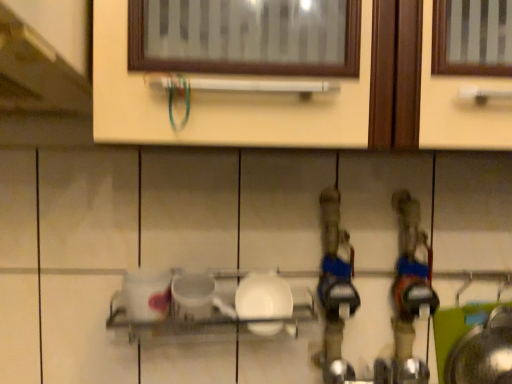
Question: Is white glossy plate at center inside the boundaries of white glossy plate at center, or outside?

Choices:
 (A) inside
 (B) outside

Answer: (B)

Question: From a real-world perspective, is white glossy plate at center physically located above or below white glossy plate at center?

Choices:
 (A) above
 (B) below

Answer: (B)

Question: Considering the positions of white glossy plate at center and white glossy plate at center in the image, is white glossy plate at center taller or shorter than white glossy plate at center?

Choices:
 (A) tall
 (B) short

Answer: (B)

Question: Is white glossy plate at center wider or thinner than white glossy plate at center?

Choices:
 (A) wide
 (B) thin

Answer: (B)

Question: From the image's perspective, is white glossy plate at center located above or below white glossy plate at center?

Choices:
 (A) below
 (B) above

Answer: (B)

Question: Is white glossy plate at center taller or shorter than white glossy plate at center?

Choices:
 (A) short
 (B) tall

Answer: (B)

Question: Considering the relative positions of white glossy plate at center and white glossy plate at center in the image provided, is white glossy plate at center to the left or to the right of white glossy plate at center?

Choices:
 (A) left
 (B) right

Answer: (B)